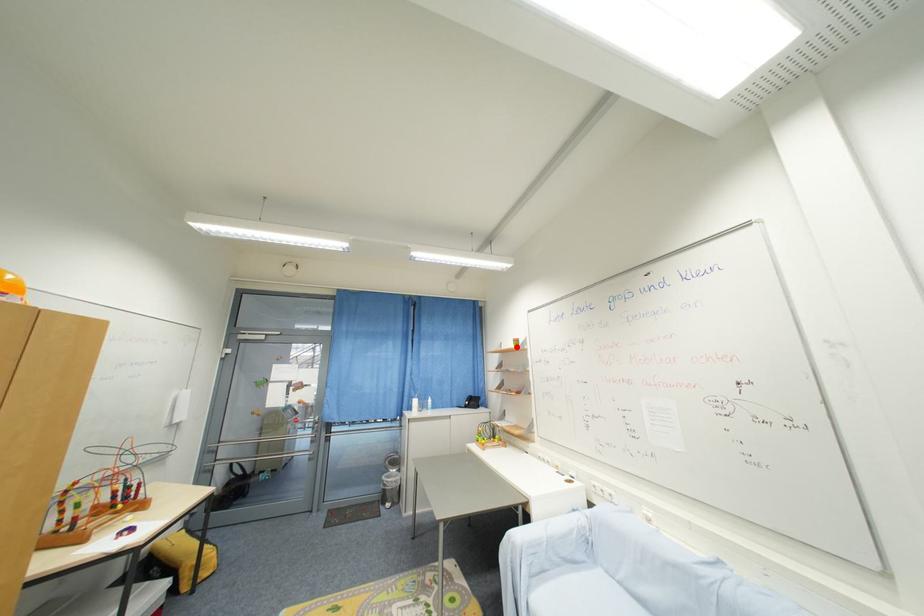
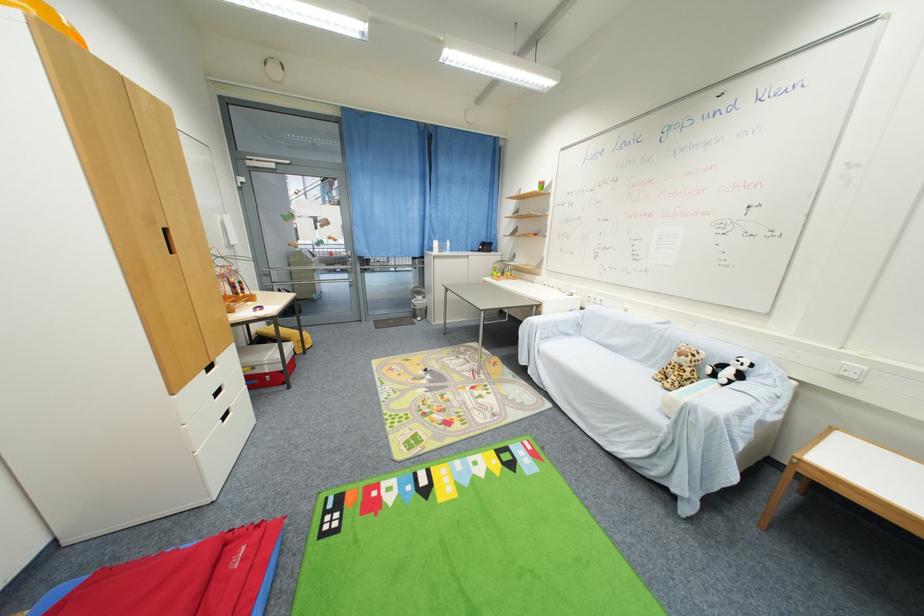
Question: I am providing you with two images of the same scene from different viewpoints. A red point is marked on the first image. Can you still see the location of the red point in image 2?

Choices:
 (A) Yes
 (B) No

Answer: (A)